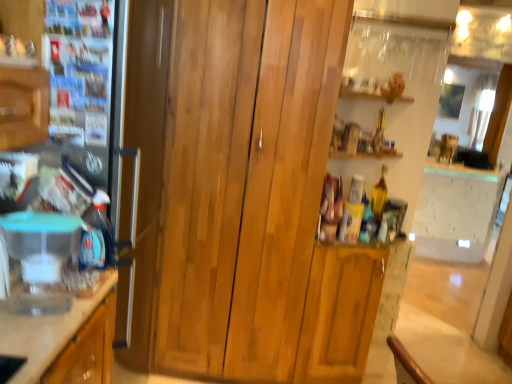
The image size is (512, 384). In order to click on vacant area situated below transparent plastic container at left (from a real-world perspective) in this screenshot , I will do `click(47, 311)`.